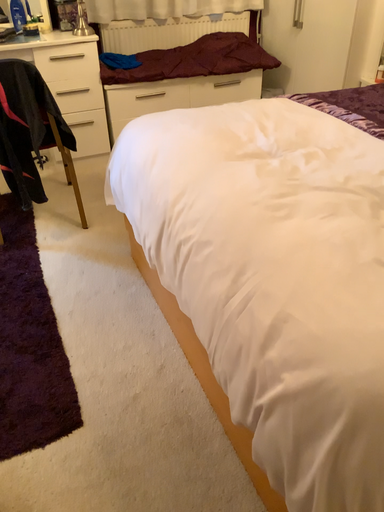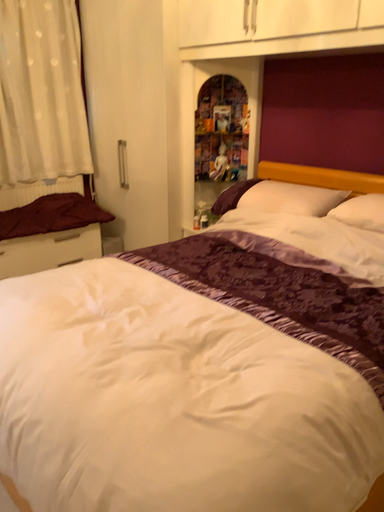
Question: How did the camera likely rotate when shooting the video?

Choices:
 (A) rotated right
 (B) rotated left

Answer: (A)